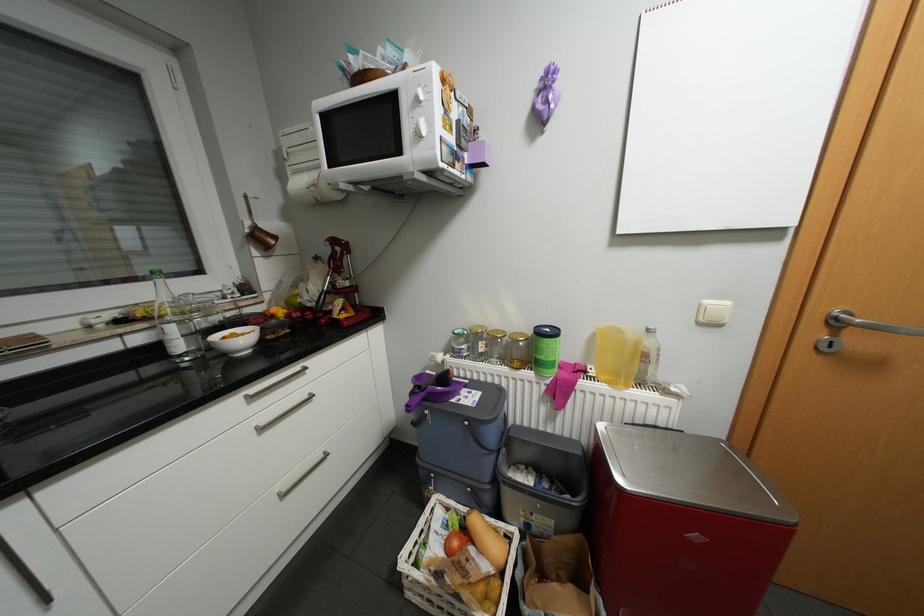
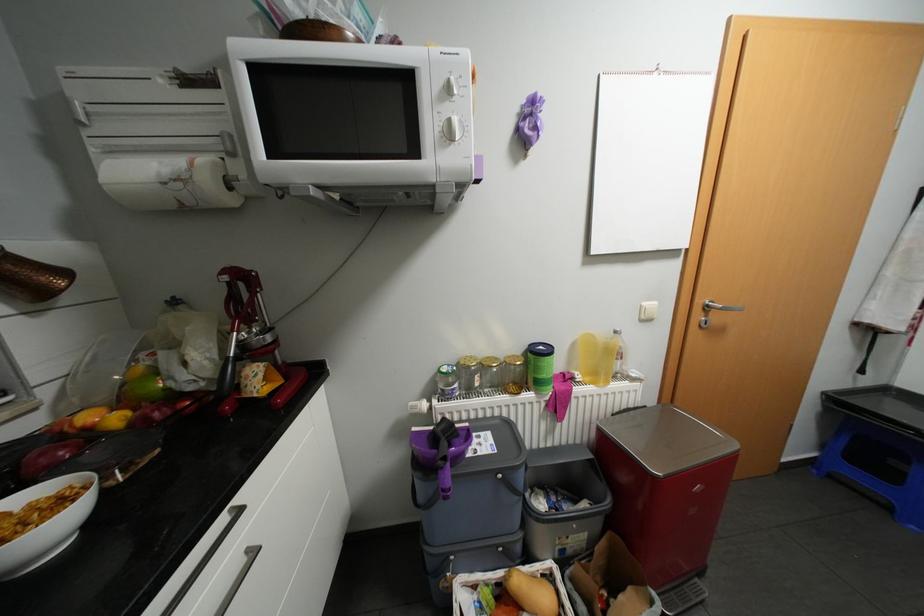
Locate, in the second image, the point that corresponds to (x=649, y=383) in the first image.

(622, 377)